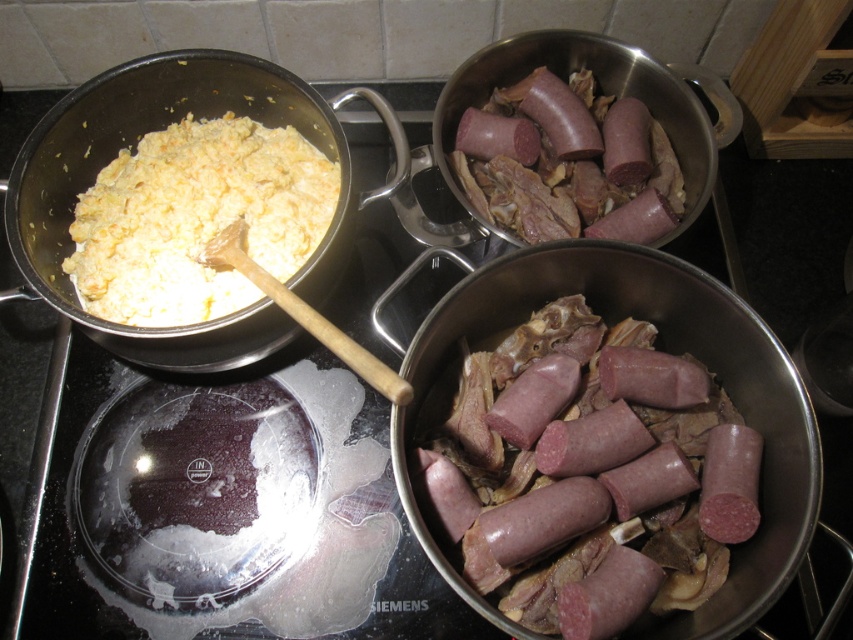
Does point (131, 244) lie behind point (581, 148)?

No, it is in front of (581, 148).

Is point (114, 227) less distant than point (529, 195)?

Yes, point (114, 227) is closer to viewer.

What do you see at coordinates (196, 218) in the screenshot? Image resolution: width=853 pixels, height=640 pixels. I see `white creamy macaroni at upper left` at bounding box center [196, 218].

Locate an element on the screen. The height and width of the screenshot is (640, 853). white creamy macaroni at upper left is located at coordinates (196, 218).

Does purple glossy sausage at center have a greater height compared to white creamy macaroni at upper left?

Correct, purple glossy sausage at center is much taller as white creamy macaroni at upper left.

The image size is (853, 640). Describe the element at coordinates (585, 472) in the screenshot. I see `purple glossy sausage at center` at that location.

This screenshot has height=640, width=853. Identify the location of purple glossy sausage at center. (585, 472).

Does purple glossy sausage at center have a greater height compared to purple glossy sausage at upper right?

Yes.

Can you confirm if purple glossy sausage at center is positioned above purple glossy sausage at upper right?

Actually, purple glossy sausage at center is below purple glossy sausage at upper right.

Is point (468, 488) farther from viewer compared to point (521, 218)?

No, (468, 488) is closer to viewer.

I want to click on purple glossy sausage at center, so click(x=585, y=472).